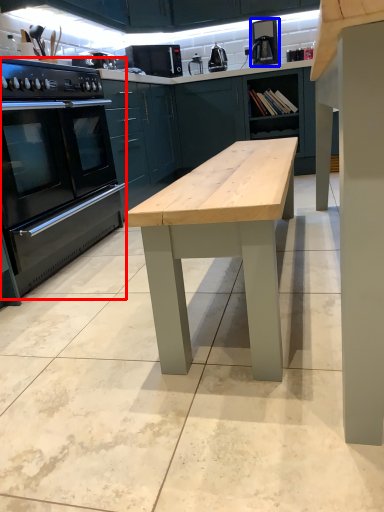
Question: Which point is closer to the camera, home appliance (highlighted by a red box) or coffee machine (highlighted by a blue box)?

Choices:
 (A) home appliance
 (B) coffee machine

Answer: (A)